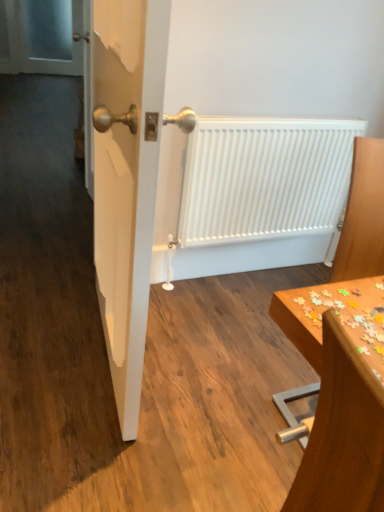
Question: Is transparent glass screen door at upper left taller than white matte radiator at center?

Choices:
 (A) no
 (B) yes

Answer: (B)

Question: Is transparent glass screen door at upper left wider than white matte radiator at center?

Choices:
 (A) yes
 (B) no

Answer: (A)

Question: Is transparent glass screen door at upper left closer to camera compared to white matte radiator at center?

Choices:
 (A) no
 (B) yes

Answer: (A)

Question: Is the depth of transparent glass screen door at upper left greater than that of white matte radiator at center?

Choices:
 (A) no
 (B) yes

Answer: (B)

Question: Is transparent glass screen door at upper left placed right next to white matte radiator at center?

Choices:
 (A) yes
 (B) no

Answer: (B)

Question: Is transparent glass screen door at upper left thinner than white matte radiator at center?

Choices:
 (A) no
 (B) yes

Answer: (A)

Question: From the image's perspective, does wooden table at right appear lower than white matte radiator at center?

Choices:
 (A) yes
 (B) no

Answer: (A)

Question: Does wooden table at right have a lesser height compared to white matte radiator at center?

Choices:
 (A) yes
 (B) no

Answer: (B)

Question: Is wooden table at right to the right of white matte radiator at center from the viewer's perspective?

Choices:
 (A) no
 (B) yes

Answer: (B)

Question: Would you consider wooden table at right to be distant from white matte radiator at center?

Choices:
 (A) yes
 (B) no

Answer: (B)

Question: Can you confirm if wooden table at right is smaller than white matte radiator at center?

Choices:
 (A) no
 (B) yes

Answer: (A)

Question: Is wooden table at right outside white matte radiator at center?

Choices:
 (A) yes
 (B) no

Answer: (A)

Question: Is wooden table at right shorter than wooden puzzle pieces at lower right?

Choices:
 (A) no
 (B) yes

Answer: (A)